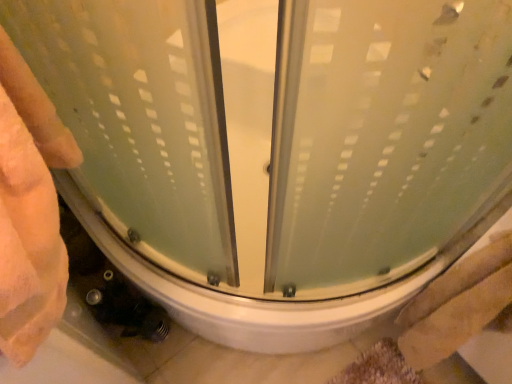
Find the location of `clear frosted glass shower door at center`. clear frosted glass shower door at center is located at coordinates (x=141, y=116).

The height and width of the screenshot is (384, 512). What do you see at coordinates (141, 116) in the screenshot? I see `clear frosted glass shower door at center` at bounding box center [141, 116].

You are a GUI agent. You are given a task and a screenshot of the screen. Output one action in this format:
    pyautogui.click(x=<x>, y=<y>)
    Task: Click on the clear frosted glass shower door at center
    Image resolution: width=512 pixels, height=384 pixels.
    Given the screenshot: What is the action you would take?
    pyautogui.click(x=141, y=116)